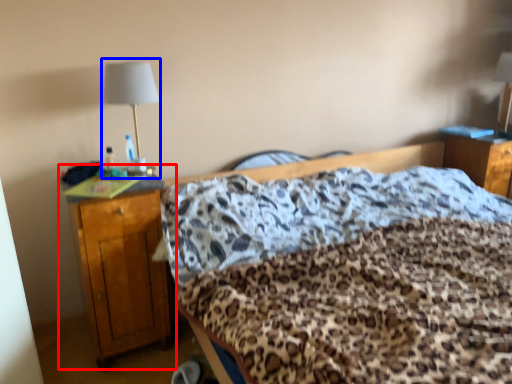
Question: Among these objects, which one is farthest to the camera, nightstand (highlighted by a red box) or bedside lamp (highlighted by a blue box)?

Choices:
 (A) nightstand
 (B) bedside lamp

Answer: (B)